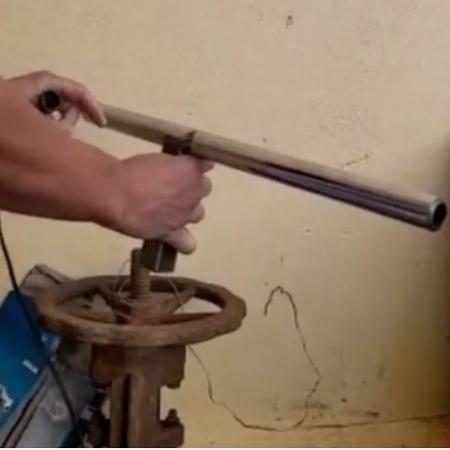
This screenshot has width=450, height=450. I want to click on handle, so click(x=204, y=155).